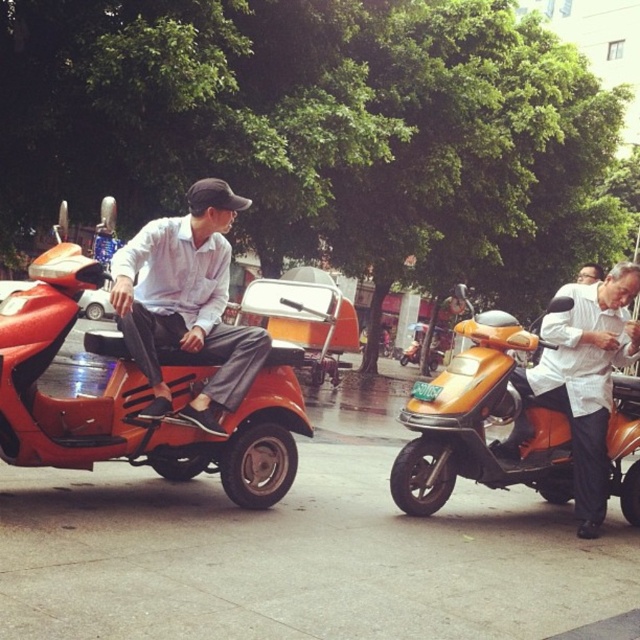
Between orange matte scooter at center and matte white shirt at center, which one appears on the left side from the viewer's perspective?

Positioned to the left is matte white shirt at center.

Does orange matte scooter at center lie behind matte white shirt at center?

Yes, it is.

Which is in front, point (570, 304) or point (125, 305)?

Point (125, 305)

Find the location of a particular element. This screenshot has width=640, height=640. orange matte scooter at center is located at coordinates (483, 422).

Does orange matte scooter at left come behind orange matte scooter at center?

No.

Who is more distant from viewer, (253, 403) or (509, 435)?

Positioned behind is point (509, 435).

Identify the location of orange matte scooter at left. Image resolution: width=640 pixels, height=640 pixels. (136, 397).

Is orange matte scooter at left positioned in front of white glossy shirt at right?

Yes, orange matte scooter at left is in front of white glossy shirt at right.

Does orange matte scooter at left lie behind white glossy shirt at right?

No.

Who is more distant from viewer, [202,378] or [600,320]?

The point [600,320] is behind.

This screenshot has height=640, width=640. In order to click on orange matte scooter at left in this screenshot , I will do pos(136,397).